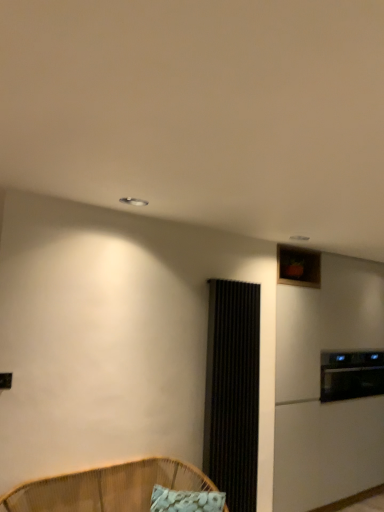
What do you see at coordinates (232, 392) in the screenshot? This screenshot has width=384, height=512. I see `black textured screen door at center-right` at bounding box center [232, 392].

In order to click on woven bamboo chair at lower left in this screenshot , I will do click(x=106, y=488).

Where is `white fabric pillow at lower center`? The height and width of the screenshot is (512, 384). white fabric pillow at lower center is located at coordinates (186, 500).

Does black textured screen door at center-right have a greater width compared to woven bamboo chair at lower left?

No, black textured screen door at center-right is not wider than woven bamboo chair at lower left.

Considering the sizes of black textured screen door at center-right and woven bamboo chair at lower left in the image, is black textured screen door at center-right taller or shorter than woven bamboo chair at lower left?

Considering their sizes, black textured screen door at center-right has more height than woven bamboo chair at lower left.

Which object is further away from the camera taking this photo, black textured screen door at center-right or woven bamboo chair at lower left?

black textured screen door at center-right is more distant.

Would you say woven bamboo chair at lower left is part of black textured screen door at center-right's contents?

Definitely not — woven bamboo chair at lower left is not inside black textured screen door at center-right.

Would you say woven bamboo chair at lower left is outside white fabric pillow at lower center?

Yes, woven bamboo chair at lower left is located beyond the bounds of white fabric pillow at lower center.

Is point (143, 496) positioned in front of point (221, 510)?

No, (143, 496) is behind (221, 510).

At what (x,y) coordinates should I click in order to perform the action: click on pillow beneath the woven bamboo chair at lower left (from a real-world perspective). Please return your answer as a coordinate pair (x, y). This screenshot has height=512, width=384. Looking at the image, I should click on click(186, 500).

Find the location of `pillow on the left of the black textured screen door at center-right`. pillow on the left of the black textured screen door at center-right is located at coordinates (186, 500).

Can you tell me how much black textured screen door at center-right and white fabric pillow at lower center differ in facing direction?

The angular difference between black textured screen door at center-right and white fabric pillow at lower center is 38.8 degrees.

Is black textured screen door at center-right positioned beyond the bounds of white fabric pillow at lower center?

black textured screen door at center-right is positioned outside white fabric pillow at lower center.

Does black textured screen door at center-right have a greater height compared to white fabric pillow at lower center?

Indeed, black textured screen door at center-right has a greater height compared to white fabric pillow at lower center.

What are the coordinates of `screen door above the black glass oven at right (from the image's perspective)` in the screenshot? It's located at pos(232,392).

Can you confirm if black glass oven at right is smaller than black textured screen door at center-right?

Incorrect, black glass oven at right is not smaller in size than black textured screen door at center-right.

Considering the relative sizes of black glass oven at right and black textured screen door at center-right in the image provided, is black glass oven at right taller than black textured screen door at center-right?

No.

Considering the relative positions of black glass oven at right and white fabric pillow at lower center in the image provided, is black glass oven at right to the right of white fabric pillow at lower center from the viewer's perspective?

Yes, black glass oven at right is to the right of white fabric pillow at lower center.

Is black glass oven at right positioned beyond the bounds of white fabric pillow at lower center?

Absolutely, black glass oven at right is external to white fabric pillow at lower center.

Is black glass oven at right oriented towards white fabric pillow at lower center?

No, black glass oven at right does not turn towards white fabric pillow at lower center.

Locate an element on the screen. This screenshot has height=512, width=384. appliance above the white fabric pillow at lower center (from the image's perspective) is located at coordinates (351, 375).

From the image's perspective, is white fabric pillow at lower center located beneath woven bamboo chair at lower left?

Indeed, from the image's perspective, white fabric pillow at lower center is shown beneath woven bamboo chair at lower left.

Find the location of a particular element. Image resolution: width=384 pixels, height=512 pixels. furniture to the left of white fabric pillow at lower center is located at coordinates (106, 488).

Which object is more forward, white fabric pillow at lower center or woven bamboo chair at lower left?

woven bamboo chair at lower left is in front.

Can you tell me how much white fabric pillow at lower center and woven bamboo chair at lower left differ in facing direction?

39.2 degrees.

Could woven bamboo chair at lower left be considered to be inside black glass oven at right?

No, black glass oven at right does not contain woven bamboo chair at lower left.

Does black glass oven at right appear on the right side of woven bamboo chair at lower left?

Yes.

I want to click on appliance on the right of woven bamboo chair at lower left, so click(x=351, y=375).

You are a GUI agent. You are given a task and a screenshot of the screen. Output one action in this format:
    pyautogui.click(x=<x>, y=<y>)
    Task: Click on the furniture lying below the black textured screen door at center-right (from the image's perspective)
    
    Given the screenshot: What is the action you would take?
    pyautogui.click(x=106, y=488)

Find the location of a particular element. furniture lying on the left of white fabric pillow at lower center is located at coordinates (106, 488).

When comparing their distances from black textured screen door at center-right, does black glass oven at right or white fabric pillow at lower center seem further?

black glass oven at right.

From the image, which object appears to be farther from white fabric pillow at lower center, black textured screen door at center-right or woven bamboo chair at lower left?

black textured screen door at center-right is positioned further to the anchor white fabric pillow at lower center.

Based on their spatial positions, is black glass oven at right or black textured screen door at center-right closer to woven bamboo chair at lower left?

black textured screen door at center-right is closer to woven bamboo chair at lower left.

Which object lies further to the anchor point woven bamboo chair at lower left, black glass oven at right or white fabric pillow at lower center?

Based on the image, black glass oven at right appears to be further to woven bamboo chair at lower left.

When comparing their distances from black textured screen door at center-right, does white fabric pillow at lower center or black glass oven at right seem closer?

Based on the image, white fabric pillow at lower center appears to be nearer to black textured screen door at center-right.

Which object lies nearer to the anchor point white fabric pillow at lower center, black glass oven at right or black textured screen door at center-right?

The object closer to white fabric pillow at lower center is black textured screen door at center-right.

Based on their spatial positions, is white fabric pillow at lower center or black textured screen door at center-right closer to woven bamboo chair at lower left?

Based on the image, white fabric pillow at lower center appears to be nearer to woven bamboo chair at lower left.

When comparing their distances from black glass oven at right, does black textured screen door at center-right or white fabric pillow at lower center seem closer?

The object closer to black glass oven at right is black textured screen door at center-right.

You are a GUI agent. You are given a task and a screenshot of the screen. Output one action in this format:
    pyautogui.click(x=<x>, y=<y>)
    Task: Click on the screen door positioned between white fabric pillow at lower center and black glass oven at right from near to far
    The image size is (384, 512).
    Given the screenshot: What is the action you would take?
    pyautogui.click(x=232, y=392)

The height and width of the screenshot is (512, 384). What are the coordinates of `pillow located between woven bamboo chair at lower left and black textured screen door at center-right in the depth direction` in the screenshot? It's located at coord(186,500).

The height and width of the screenshot is (512, 384). Identify the location of screen door positioned between woven bamboo chair at lower left and black glass oven at right from near to far. (232, 392).

The width and height of the screenshot is (384, 512). In order to click on pillow located between woven bamboo chair at lower left and black glass oven at right in the depth direction in this screenshot , I will do `click(186, 500)`.